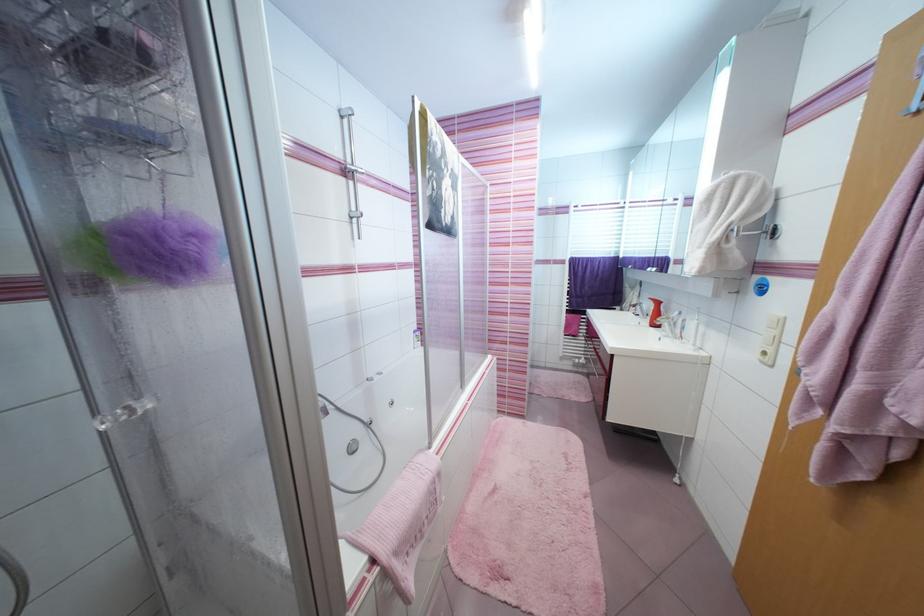
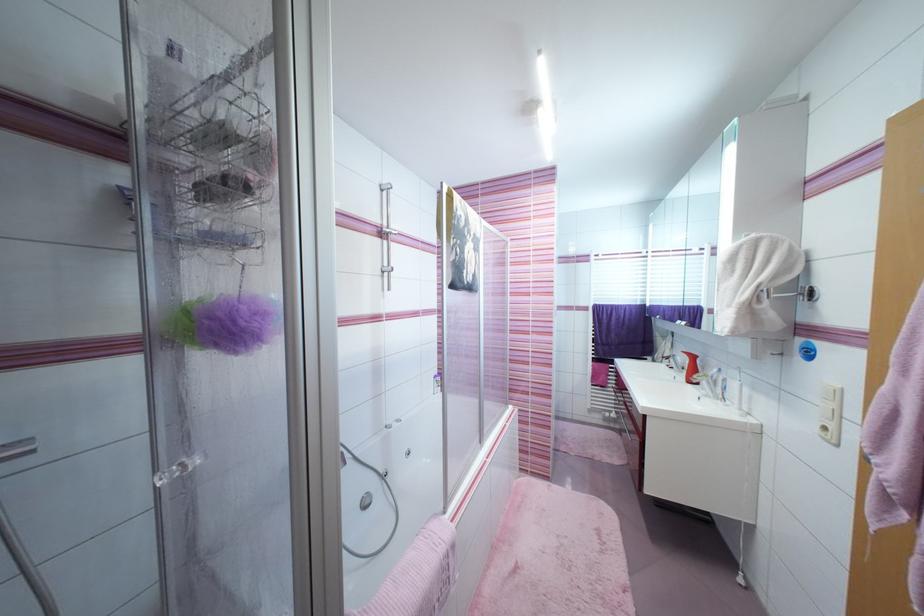
Where in the second image is the point corresponding to the point at 347,119 from the first image?

(387, 192)